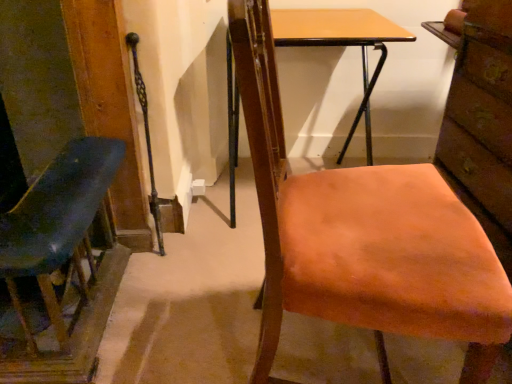
Question: From a real-world perspective, is orange fabric chair at center, which ranks as the 2th chair in left-to-right order, positioned under light brown wood desk at center based on gravity?

Choices:
 (A) yes
 (B) no

Answer: (B)

Question: Is orange fabric chair at center, which is the first chair from right to left, beside light brown wood desk at center?

Choices:
 (A) yes
 (B) no

Answer: (B)

Question: Considering the relative sizes of orange fabric chair at center, which ranks as the 2th chair in left-to-right order, and light brown wood desk at center in the image provided, is orange fabric chair at center, which ranks as the 2th chair in left-to-right order, taller than light brown wood desk at center?

Choices:
 (A) yes
 (B) no

Answer: (A)

Question: Considering the relative sizes of orange fabric chair at center, which is the first chair from right to left, and light brown wood desk at center in the image provided, is orange fabric chair at center, which is the first chair from right to left, smaller than light brown wood desk at center?

Choices:
 (A) no
 (B) yes

Answer: (B)

Question: Does orange fabric chair at center, which ranks as the 2th chair in left-to-right order, turn towards light brown wood desk at center?

Choices:
 (A) no
 (B) yes

Answer: (A)

Question: Is orange fabric chair at center, which is the first chair from right to left, to the right of light brown wood desk at center from the viewer's perspective?

Choices:
 (A) no
 (B) yes

Answer: (B)

Question: From the image's perspective, would you say matte blue chair at left, arranged as the first chair when viewed from the left, is positioned over light brown wood desk at center?

Choices:
 (A) yes
 (B) no

Answer: (B)

Question: From a real-world perspective, is matte blue chair at left, the second chair when ordered from right to left, physically above light brown wood desk at center?

Choices:
 (A) yes
 (B) no

Answer: (B)

Question: Are matte blue chair at left, arranged as the first chair when viewed from the left, and light brown wood desk at center far apart?

Choices:
 (A) no
 (B) yes

Answer: (A)

Question: Is matte blue chair at left, arranged as the first chair when viewed from the left, bigger than light brown wood desk at center?

Choices:
 (A) yes
 (B) no

Answer: (B)

Question: Considering the relative positions of matte blue chair at left, the second chair when ordered from right to left, and light brown wood desk at center in the image provided, is matte blue chair at left, the second chair when ordered from right to left, behind light brown wood desk at center?

Choices:
 (A) yes
 (B) no

Answer: (B)

Question: From a real-world perspective, is matte blue chair at left, arranged as the first chair when viewed from the left, under light brown wood desk at center?

Choices:
 (A) yes
 (B) no

Answer: (A)

Question: Can you confirm if matte blue chair at left, the second chair when ordered from right to left, is bigger than brick textured drawer at right?

Choices:
 (A) no
 (B) yes

Answer: (B)